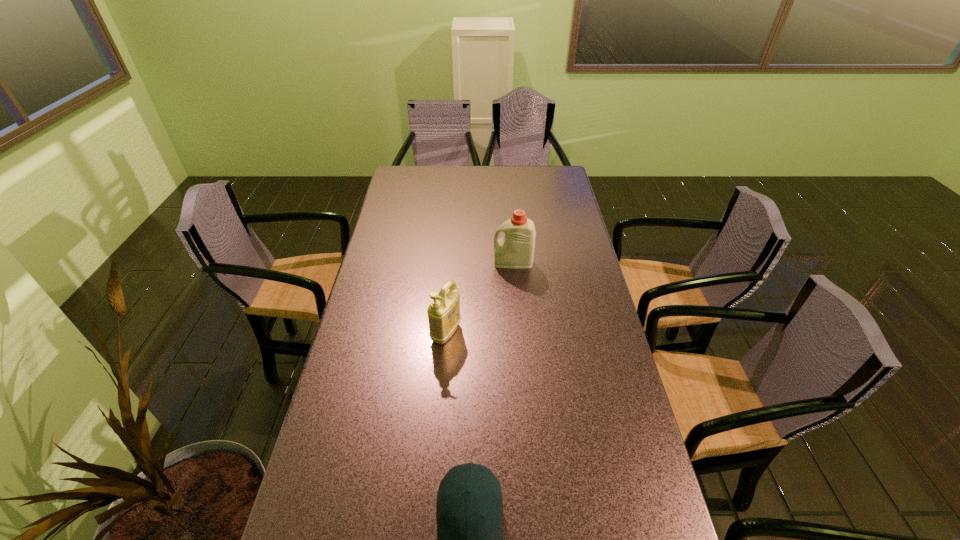
Locate an element on the screen. Image resolution: width=960 pixels, height=540 pixels. free spot at the right edge of the desktop is located at coordinates (604, 342).

Locate an element on the screen. Image resolution: width=960 pixels, height=540 pixels. free space at the far left corner is located at coordinates pyautogui.click(x=418, y=191).

Locate an element on the screen. The width and height of the screenshot is (960, 540). empty space between the right detergent and the second farthest object is located at coordinates (480, 298).

The image size is (960, 540). I want to click on free space between the second nearest object and the farthest object, so click(x=480, y=298).

Where is `object that ranks as the second closest to the nearer detergent`? Image resolution: width=960 pixels, height=540 pixels. object that ranks as the second closest to the nearer detergent is located at coordinates (469, 491).

What are the coordinates of `object that is the second closest to the farthest object` in the screenshot? It's located at (469, 491).

Find the location of `free space that satisfies the following two spatial constraints: 1. on the handle side of the farthest object; 2. on the front side of the left detergent`. free space that satisfies the following two spatial constraints: 1. on the handle side of the farthest object; 2. on the front side of the left detergent is located at coordinates (519, 333).

Identify the location of vacant space that satisfies the following two spatial constraints: 1. on the handle side of the farthest object; 2. on the front side of the left detergent. Image resolution: width=960 pixels, height=540 pixels. (519, 333).